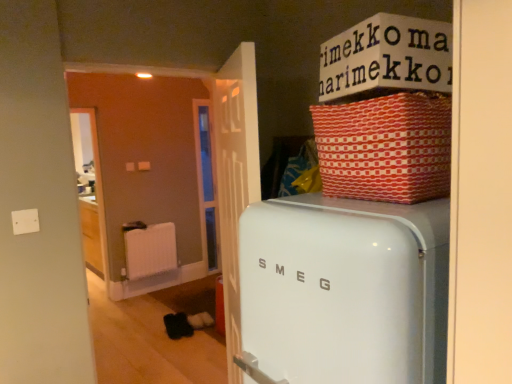
Question: Does white plastic radiator at center appear on the right side of red woven basket at upper right?

Choices:
 (A) yes
 (B) no

Answer: (B)

Question: Is white plastic radiator at center wider than red woven basket at upper right?

Choices:
 (A) no
 (B) yes

Answer: (A)

Question: From a real-world perspective, is white plastic radiator at center located higher than red woven basket at upper right?

Choices:
 (A) no
 (B) yes

Answer: (A)

Question: Does white plastic radiator at center come in front of red woven basket at upper right?

Choices:
 (A) yes
 (B) no

Answer: (B)

Question: Can you confirm if white plastic radiator at center is smaller than red woven basket at upper right?

Choices:
 (A) no
 (B) yes

Answer: (B)

Question: Is white plastic radiator at center surrounding red woven basket at upper right?

Choices:
 (A) no
 (B) yes

Answer: (A)

Question: Can you confirm if white plastic radiator at center is thinner than white glossy refrigerator at center?

Choices:
 (A) yes
 (B) no

Answer: (A)

Question: From a real-world perspective, is white plastic radiator at center physically below white glossy refrigerator at center?

Choices:
 (A) no
 (B) yes

Answer: (B)

Question: Is white plastic radiator at center next to white glossy refrigerator at center?

Choices:
 (A) no
 (B) yes

Answer: (A)

Question: Is the depth of white plastic radiator at center less than that of white glossy refrigerator at center?

Choices:
 (A) no
 (B) yes

Answer: (A)

Question: Does white plastic radiator at center appear on the left side of white glossy refrigerator at center?

Choices:
 (A) no
 (B) yes

Answer: (B)

Question: Does white plastic radiator at center have a greater height compared to white glossy refrigerator at center?

Choices:
 (A) yes
 (B) no

Answer: (B)

Question: Is white cardboard box at upper center at the right side of white glossy refrigerator at center?

Choices:
 (A) yes
 (B) no

Answer: (A)